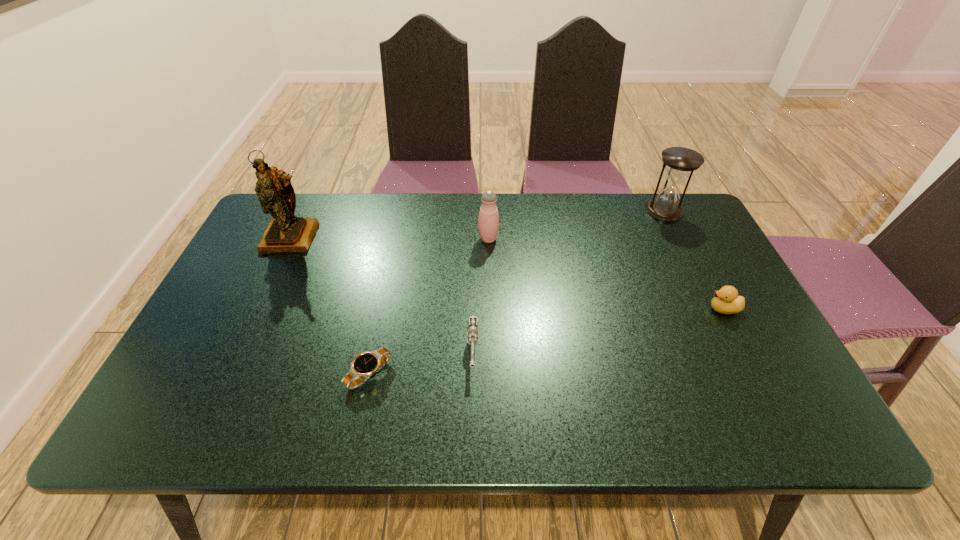
In order to click on free point between the duckling and the hourglass in this screenshot , I will do `click(694, 260)`.

The height and width of the screenshot is (540, 960). In order to click on unoccupied area between the figurine and the third nearest object in this screenshot , I will do `click(508, 273)`.

Find the location of a particular element. vacant space that's between the figurine and the third nearest object is located at coordinates (x=508, y=273).

This screenshot has width=960, height=540. I want to click on free space between the thermos bottle and the duckling, so click(x=606, y=274).

Image resolution: width=960 pixels, height=540 pixels. In order to click on vacant region between the fourth farthest object and the shortest object in this screenshot , I will do `click(546, 341)`.

Locate an element on the screen. Image resolution: width=960 pixels, height=540 pixels. empty space between the third nearest object and the hourglass is located at coordinates (694, 260).

Identify the location of vacant space in between the duckling and the tallest object. pyautogui.click(x=508, y=273).

Find the location of a particular element. The image size is (960, 540). unoccupied position between the fifth object from right to left and the thermos bottle is located at coordinates (428, 307).

Image resolution: width=960 pixels, height=540 pixels. What are the coordinates of `empty location between the hourglass and the thermos bottle` in the screenshot? It's located at (576, 225).

Image resolution: width=960 pixels, height=540 pixels. What are the coordinates of `object that stands as the fifth closest to the thermos bottle` in the screenshot? It's located at (726, 300).